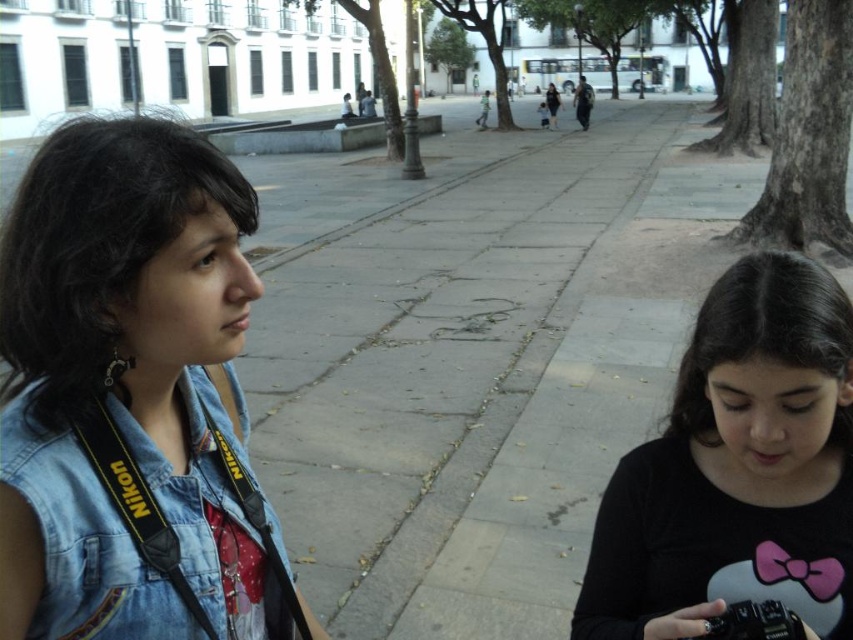
Question: Which is farther from the denim jacket at left?

Choices:
 (A) black plastic camera at lower right
 (B) black matte shirt at center
 (C) denim jacket at lower left

Answer: (A)

Question: Which point is closer to the camera?

Choices:
 (A) (16, 228)
 (B) (735, 616)
 (C) (805, 515)

Answer: (A)

Question: Can you confirm if denim jacket at left is positioned to the right of black matte shirt at center?

Choices:
 (A) no
 (B) yes

Answer: (A)

Question: Which point is farther to the camera?

Choices:
 (A) (88, 294)
 (B) (741, 627)
 (C) (79, 588)

Answer: (B)

Question: Can you confirm if black matte shirt at center is smaller than denim jacket at lower left?

Choices:
 (A) no
 (B) yes

Answer: (A)

Question: Does black matte shirt at center have a larger size compared to black plastic camera at lower right?

Choices:
 (A) yes
 (B) no

Answer: (A)